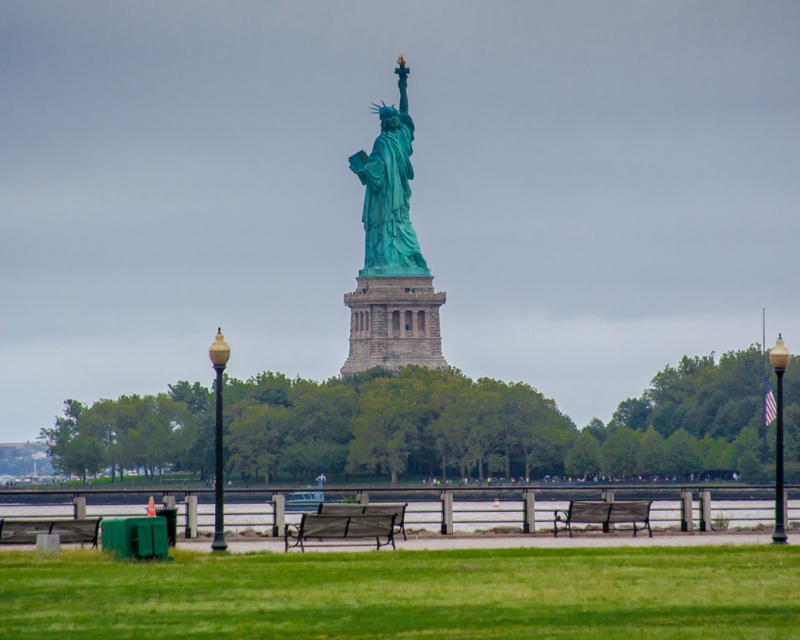
Is point (389, 148) farther from camera compared to point (384, 529)?

Yes.

Can you confirm if green patina statue at center is positioned below metallic green bench at center?

No.

Is point (368, 193) positioned behind point (392, 545)?

Yes, it is.

Identify the location of green patina statue at center. (389, 192).

Can you confirm if metallic green bench at center is positioned below wooden park bench at center?

Yes, metallic green bench at center is below wooden park bench at center.

Is metallic green bench at center above wooden park bench at center?

Incorrect, metallic green bench at center is not positioned above wooden park bench at center.

Where is `metallic green bench at center`? The height and width of the screenshot is (640, 800). metallic green bench at center is located at coordinates (342, 528).

Can you confirm if wooden bench at center is positioned to the right of matte yellow lamp post at center?

No, wooden bench at center is not to the right of matte yellow lamp post at center.

Does wooden bench at center appear under matte yellow lamp post at center?

Yes, wooden bench at center is below matte yellow lamp post at center.

I want to click on wooden bench at center, so click(x=49, y=529).